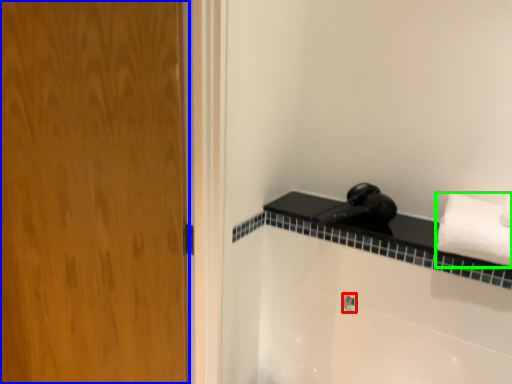
Question: Considering the real-world distances, which object is farthest from shower (highlighted by a red box)? door (highlighted by a blue box) or towel (highlighted by a green box)?

Choices:
 (A) door
 (B) towel

Answer: (A)